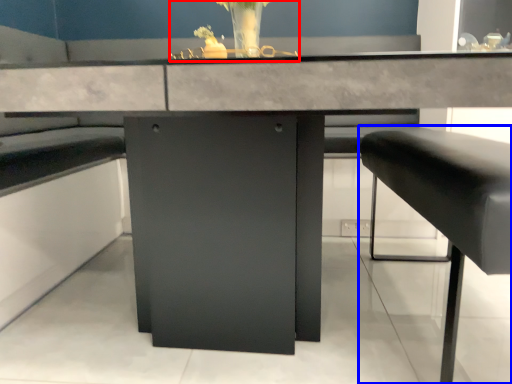
Question: Which object is closer to the camera taking this photo, floral arrangement (highlighted by a red box) or furniture (highlighted by a blue box)?

Choices:
 (A) floral arrangement
 (B) furniture

Answer: (B)